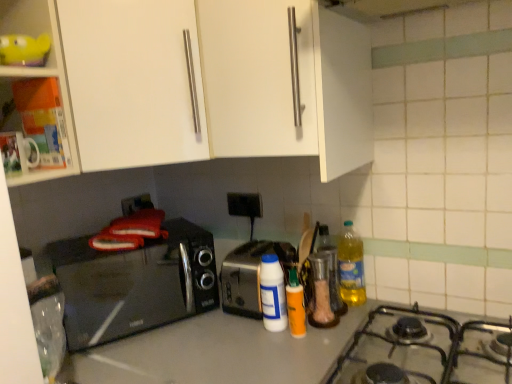
Question: Is smooth gray countertop at center further to the viewer compared to black plastic outlet at center?

Choices:
 (A) no
 (B) yes

Answer: (A)

Question: From a real-world perspective, is smooth gray countertop at center on top of black plastic outlet at center?

Choices:
 (A) no
 (B) yes

Answer: (A)

Question: Would you say smooth gray countertop at center is a long distance from black plastic outlet at center?

Choices:
 (A) yes
 (B) no

Answer: (B)

Question: Is smooth gray countertop at center bigger than black plastic outlet at center?

Choices:
 (A) no
 (B) yes

Answer: (B)

Question: Does smooth gray countertop at center lie in front of black plastic outlet at center?

Choices:
 (A) yes
 (B) no

Answer: (A)

Question: Considering the relative sizes of smooth gray countertop at center and black plastic outlet at center in the image provided, is smooth gray countertop at center taller than black plastic outlet at center?

Choices:
 (A) no
 (B) yes

Answer: (B)

Question: Is white plastic bottle at center, the first bottle positioned from the left, behind white glossy cabinet at upper left, which is the first cabinetry in left-to-right order?

Choices:
 (A) yes
 (B) no

Answer: (A)

Question: Is white plastic bottle at center, which ranks as the third bottle in right-to-left order, taller than white glossy cabinet at upper left, which is the first cabinetry in left-to-right order?

Choices:
 (A) yes
 (B) no

Answer: (B)

Question: From a real-world perspective, is white plastic bottle at center, which ranks as the third bottle in right-to-left order, over white glossy cabinet at upper left, which is the first cabinetry in left-to-right order?

Choices:
 (A) yes
 (B) no

Answer: (B)

Question: Does white plastic bottle at center, which ranks as the third bottle in right-to-left order, turn towards white glossy cabinet at upper left, which appears as the 3th cabinetry when viewed from the right?

Choices:
 (A) no
 (B) yes

Answer: (A)

Question: From a real-world perspective, is white plastic bottle at center, the first bottle positioned from the left, beneath white glossy cabinet at upper left, which appears as the 3th cabinetry when viewed from the right?

Choices:
 (A) no
 (B) yes

Answer: (B)

Question: Is white plastic bottle at center, the first bottle positioned from the left, facing away from white glossy cabinet at upper left, which is the first cabinetry in left-to-right order?

Choices:
 (A) yes
 (B) no

Answer: (B)

Question: From a real-world perspective, is silver metallic toaster at center beneath orange matte bottle at center, acting as the 2th bottle starting from the left?

Choices:
 (A) yes
 (B) no

Answer: (B)